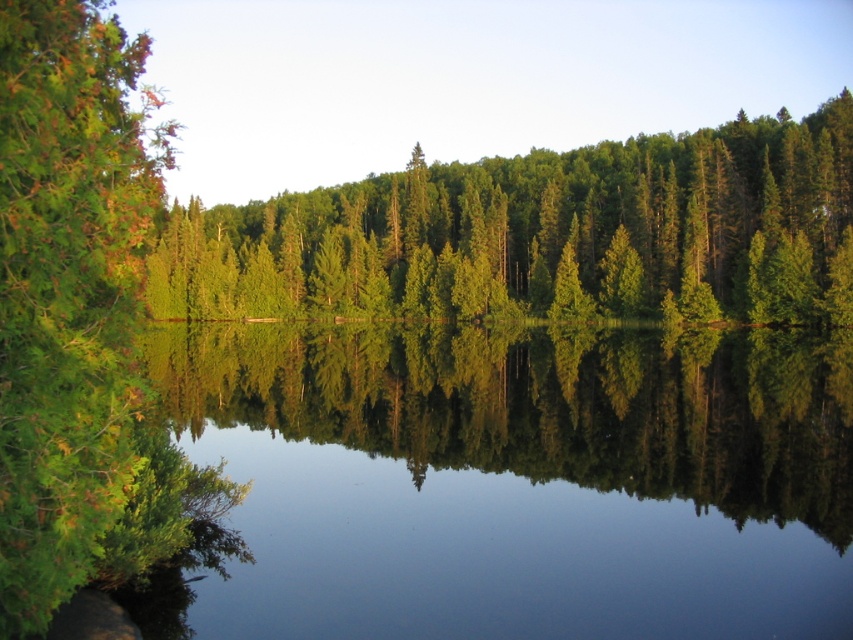
Can you confirm if green matte tree at center is positioned to the right of green leafy tree at left?

Correct, you'll find green matte tree at center to the right of green leafy tree at left.

Who is lower down, green matte tree at center or green leafy tree at left?

green leafy tree at left

Between point (527, 189) and point (59, 456), which one is positioned in front?

Positioned in front is point (59, 456).

Locate an element on the screen. green matte tree at center is located at coordinates (543, 234).

Does clear water at center have a greater height compared to green matte tree at center?

In fact, clear water at center may be shorter than green matte tree at center.

I want to click on clear water at center, so click(515, 480).

Locate an element on the screen. clear water at center is located at coordinates (515, 480).

Does point (194, 333) come behind point (77, 260)?

Yes, it is.

Which is in front, point (434, 563) or point (106, 424)?

Point (106, 424) is more forward.

Is point (401, 628) closer to viewer compared to point (44, 508)?

That is False.

Identify the location of clear water at center. The width and height of the screenshot is (853, 640). (515, 480).